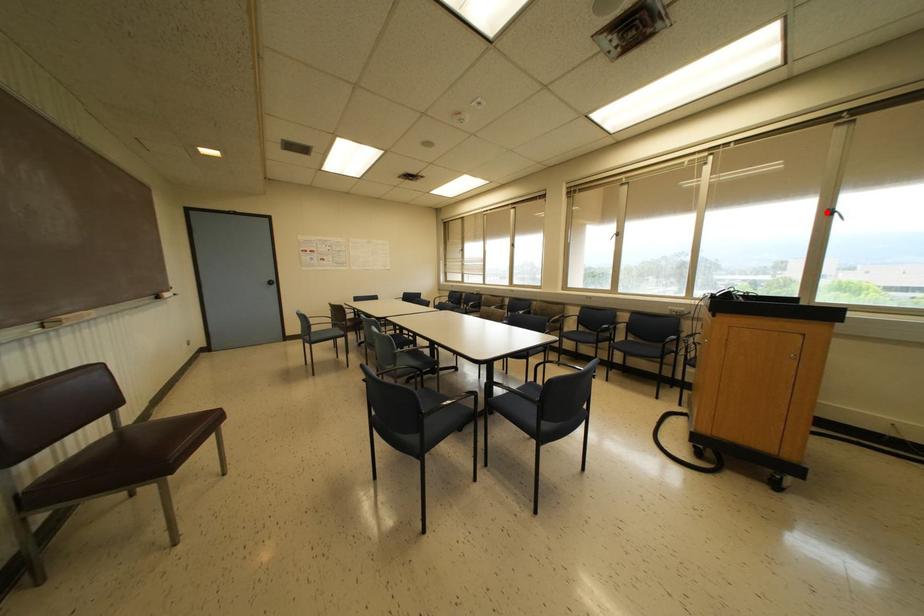
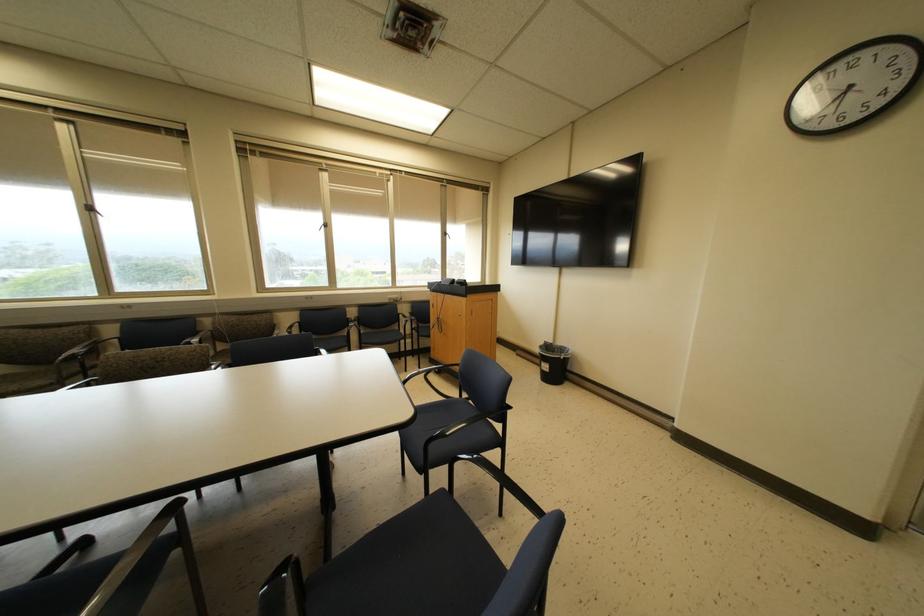
Question: I am providing you with two images of the same scene from different viewpoints. Given a red point in image1, look at the same physical point in image2. Is it:

Choices:
 (A) Closer to the viewpoint
 (B) Farther from the viewpoint

Answer: (A)